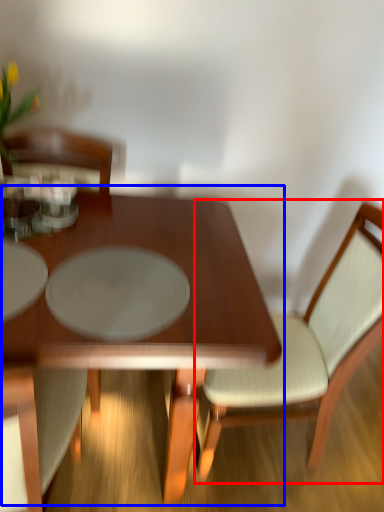
Question: Which object appears closest to the camera in this image, chair (highlighted by a red box) or coffee table (highlighted by a blue box)?

Choices:
 (A) chair
 (B) coffee table

Answer: (B)